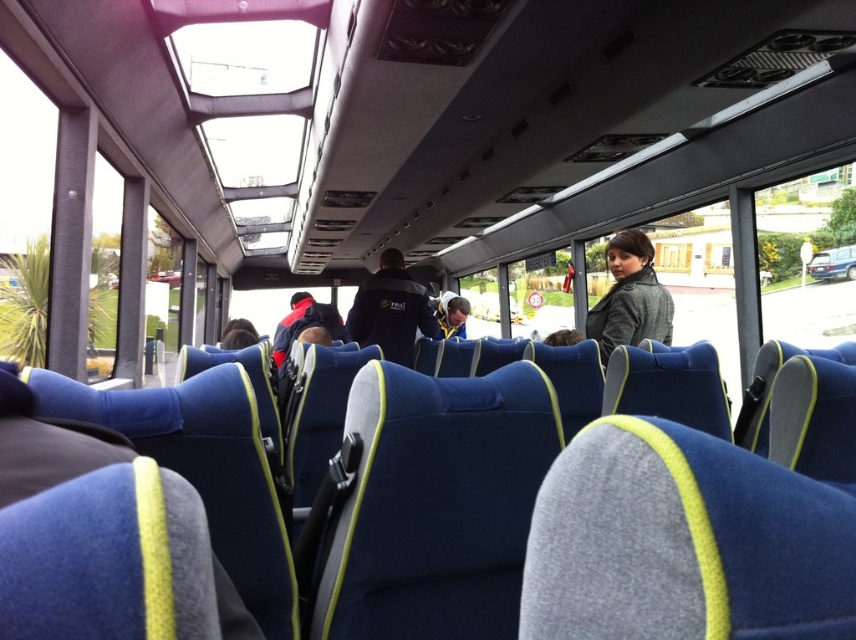
You are a passenger on the bus and want to know which jacket is narrower between the matte black jacket at upper right and the dark blue fabric jacket at center. Can you tell me?

The matte black jacket at upper right is narrower than the dark blue fabric jacket at center because its width is less than the dark blue fabric jacket at center.

You are standing inside the bus and looking at two points marked on the seats. The first point is at coordinates point [625,284] and the second is at point [382,256]. Which point is closer to you?

Point [625,284] is closer to the viewer than point [382,256].

In the scene shown: You are a passenger sitting in the middle of the bus and notice two jackets hanging on the back of the seats in front of you. Which jacket is closer to the right side of the bus, the matte black jacket at upper right or the dark blue fabric jacket at center?

The matte black jacket at upper right is closer to the right side of the bus because it is positioned to the right of the dark blue fabric jacket at center.